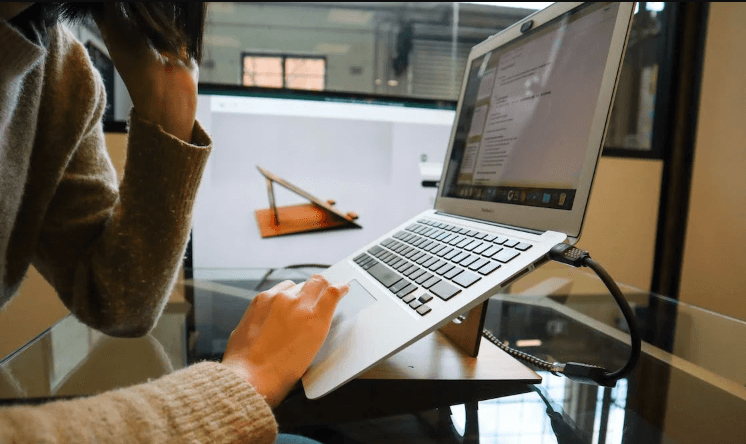
I want to click on glass desk, so click(136, 357).